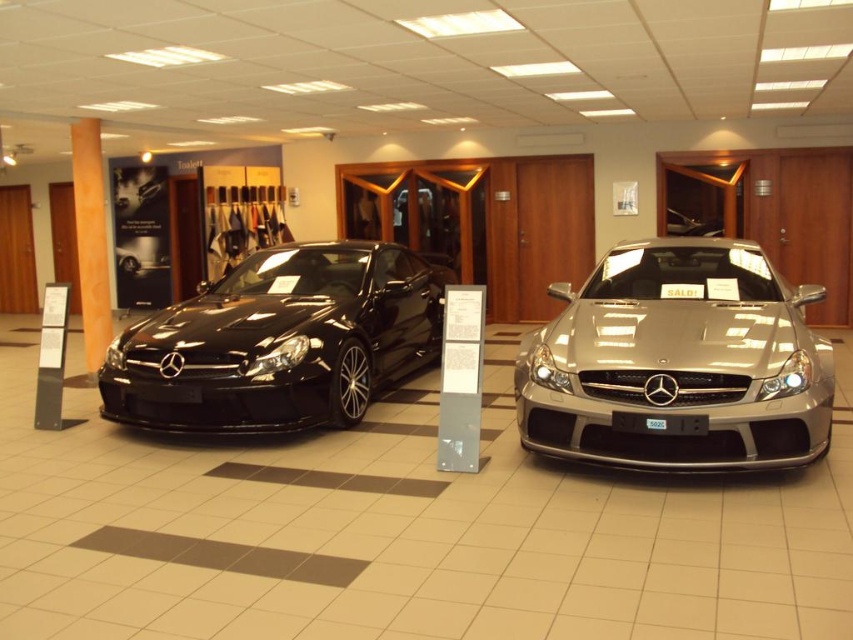
Does satin silver car at center have a smaller size compared to matte black car at left?

Indeed, satin silver car at center has a smaller size compared to matte black car at left.

Can you confirm if satin silver car at center is bigger than matte black car at left?

Actually, satin silver car at center might be smaller than matte black car at left.

Which is behind, point (543, 449) or point (285, 348)?

The point (285, 348) is more distant.

Where is `satin silver car at center`? The height and width of the screenshot is (640, 853). satin silver car at center is located at coordinates (677, 364).